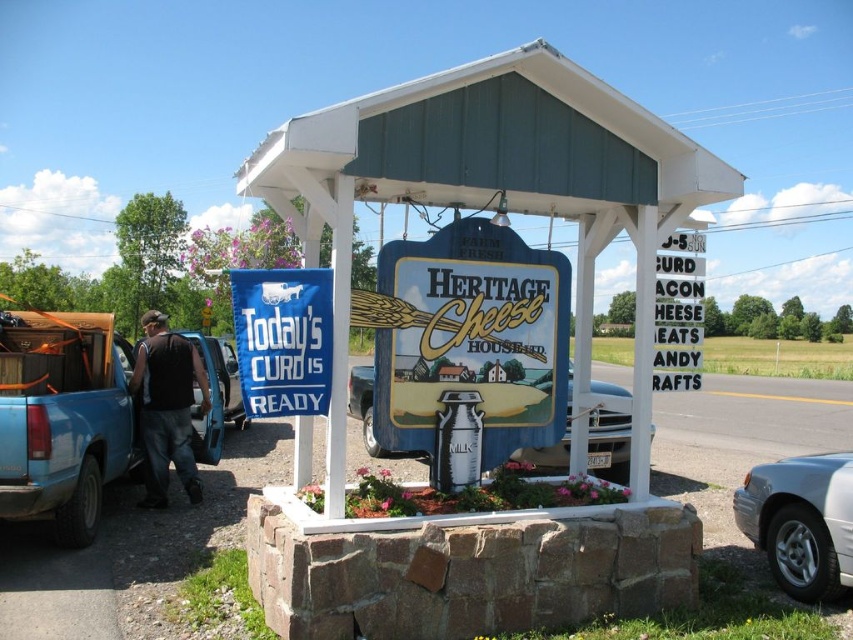
Question: Is the position of blue matte truck at lower left more distant than that of black plastic sign at upper right?

Choices:
 (A) yes
 (B) no

Answer: (A)

Question: Does blue painted wood heritage cheese sign at center appear on the right side of black fabric backpack at left?

Choices:
 (A) yes
 (B) no

Answer: (A)

Question: Is black fabric backpack at left to the left of black plastic sign at upper right from the viewer's perspective?

Choices:
 (A) yes
 (B) no

Answer: (A)

Question: Which point is closer to the camera?

Choices:
 (A) (242, 342)
 (B) (517, 157)
 (C) (177, 380)
 (D) (494, 365)

Answer: (A)

Question: Which of the following is the closest to the observer?

Choices:
 (A) blue matte truck at lower left
 (B) blue painted wood heritage cheese sign at center

Answer: (B)

Question: Which of the following is the farthest from the observer?

Choices:
 (A) metallic blue truck at center
 (B) black fabric backpack at left
 (C) blue fabric banner at center
 (D) blue painted wood heritage cheese sign at center

Answer: (B)